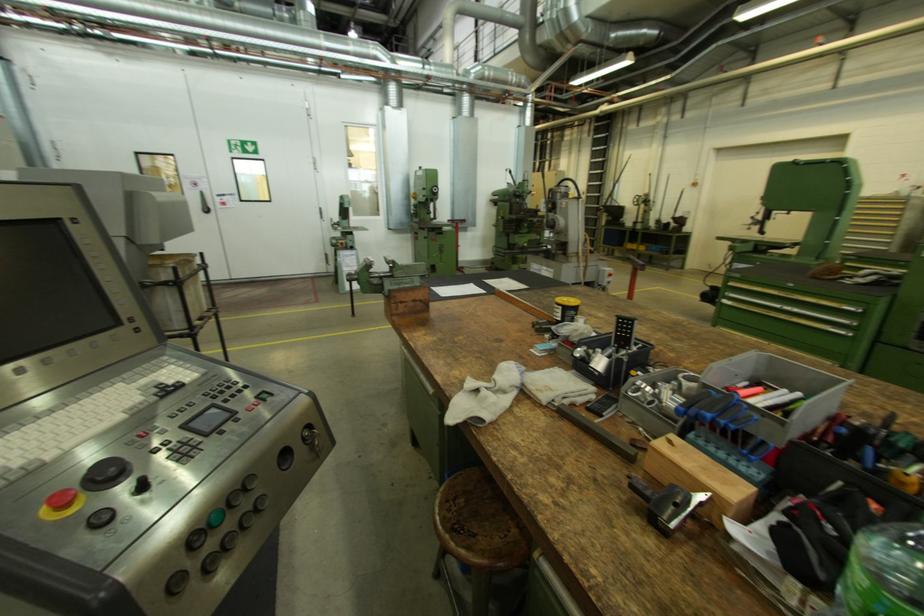
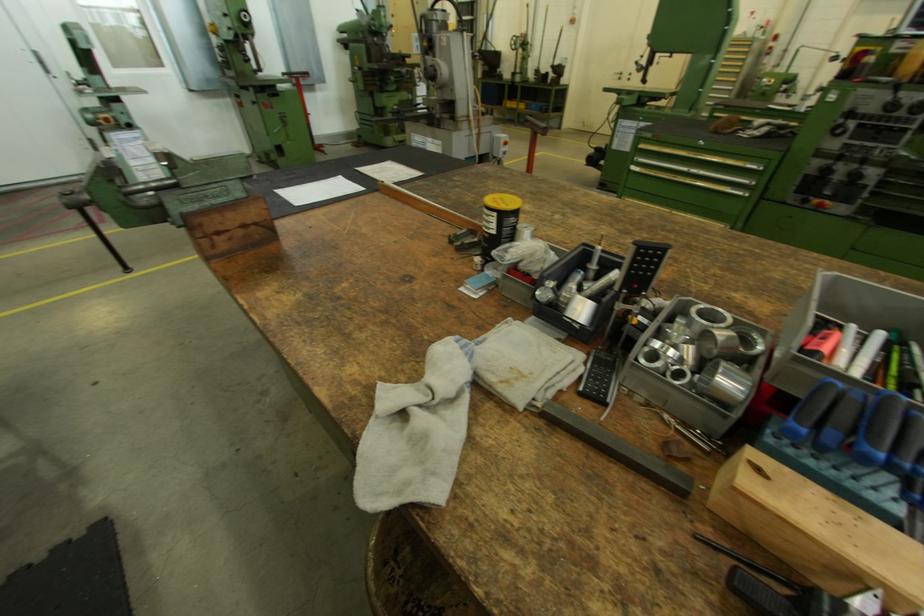
Where in the second image is the point corresponding to (758,219) from the first image?

(642, 63)